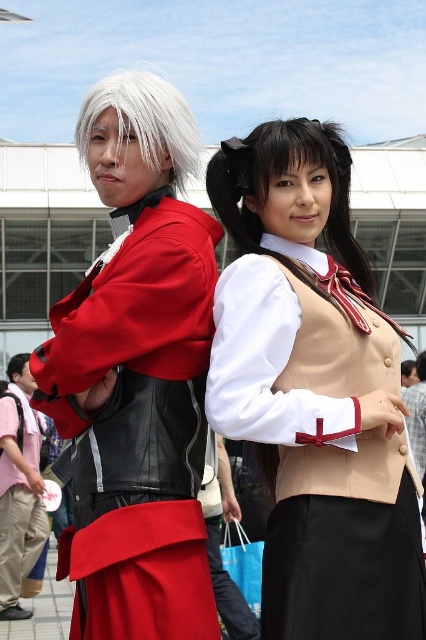
Can you confirm if matte black vest at left is smaller than brushed metal backpack at lower left?

Indeed, matte black vest at left has a smaller size compared to brushed metal backpack at lower left.

The width and height of the screenshot is (426, 640). What are the coordinates of `matte black vest at left` in the screenshot? It's located at (138, 426).

You are a GUI agent. You are given a task and a screenshot of the screen. Output one action in this format:
    pyautogui.click(x=<x>, y=<y>)
    Task: Click on the matte black vest at left
    
    Given the screenshot: What is the action you would take?
    pyautogui.click(x=138, y=426)

Can you confirm if beige fabric vest at center is wider than brushed metal backpack at lower left?

Yes, beige fabric vest at center is wider than brushed metal backpack at lower left.

Is beige fabric vest at center positioned before brushed metal backpack at lower left?

Yes.

Measure the distance between point (362, 621) and camera.

Point (362, 621) is 30.39 meters away from camera.

Find the location of a particular element. The height and width of the screenshot is (640, 426). beige fabric vest at center is located at coordinates (314, 390).

Can you confirm if black silky hair at center is positioned below whitehair at left?

Yes.

Does point (235, 234) lie in front of point (175, 131)?

No, (235, 234) is behind (175, 131).

Identify the location of black silky hair at center. The height and width of the screenshot is (640, 426). click(x=276, y=177).